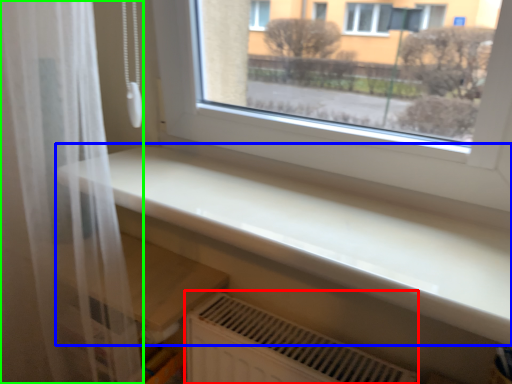
Question: Which object is positioned farthest from air conditioning (highlighted by a red box)? Select from counter top (highlighted by a blue box) and shower curtain (highlighted by a green box).

Choices:
 (A) counter top
 (B) shower curtain

Answer: (B)